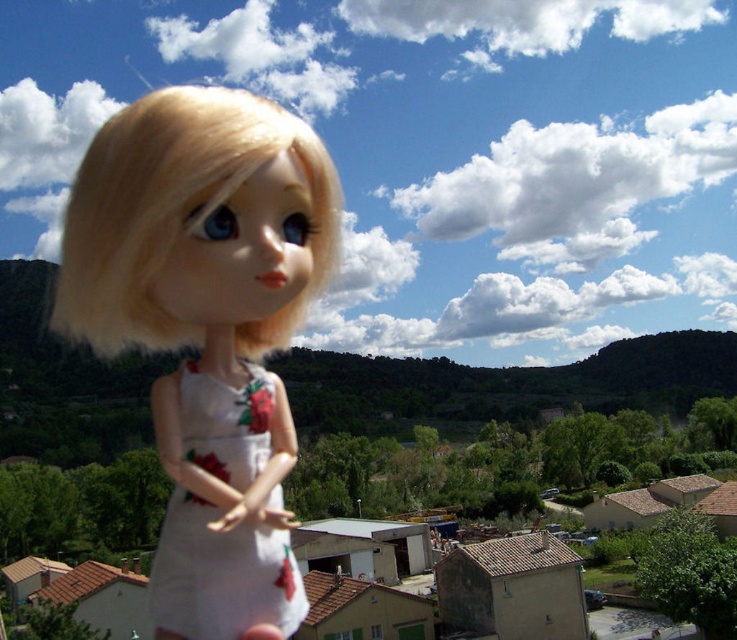
Can you confirm if satin white doll at center is shorter than white matte dress at left?

No.

Is satin white doll at center wider than white matte dress at left?

Yes.

Is point (83, 212) positioned in front of point (206, 618)?

Yes.

At what (x,y) coordinates should I click in order to perform the action: click on satin white doll at center. Please return your answer as a coordinate pair (x, y). Looking at the image, I should click on (206, 326).